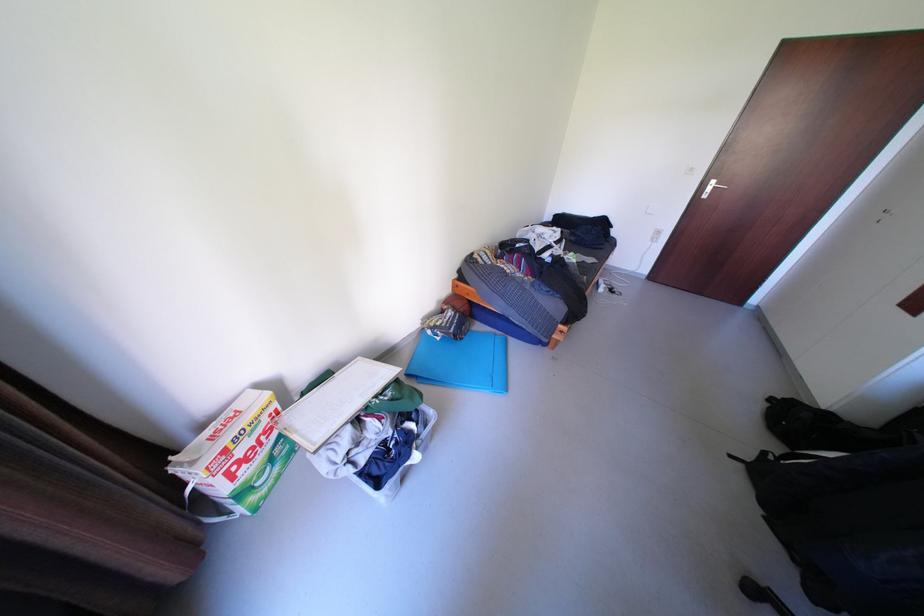
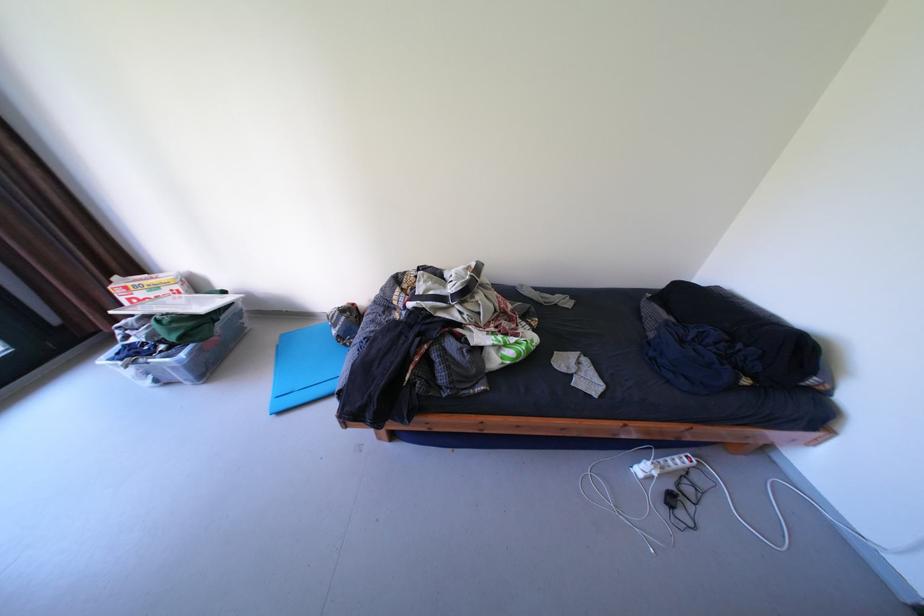
Find the pixel in the second image that matches pixel 612 291 in the first image.

(649, 471)